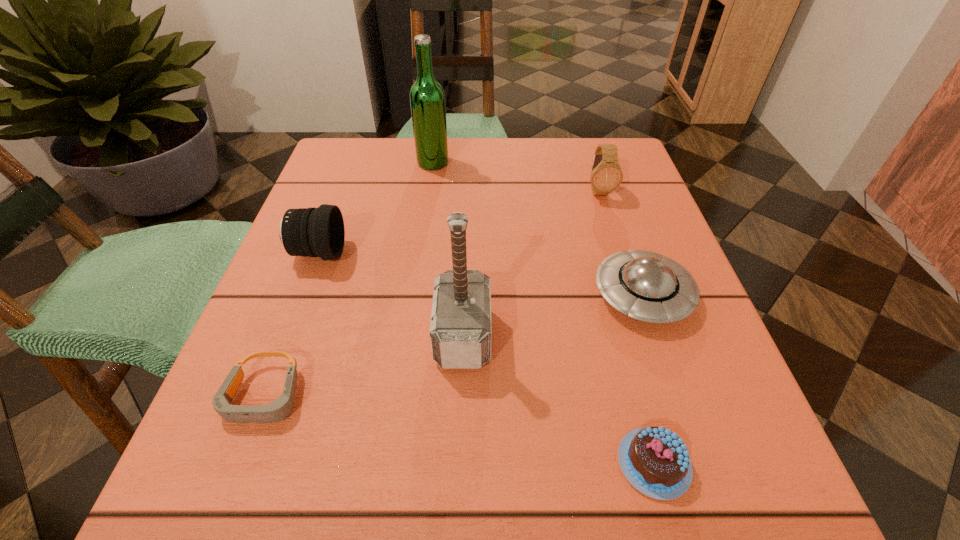
Locate an element on the screen. goggles located in the left edge section of the desktop is located at coordinates (280, 408).

Locate an element on the screen. watch that is at the right edge is located at coordinates (606, 175).

Image resolution: width=960 pixels, height=540 pixels. Find the location of `saucer that is positioned at the right edge`. saucer that is positioned at the right edge is located at coordinates (649, 287).

Find the location of a particular element. The height and width of the screenshot is (540, 960). chocolate cake at the right edge is located at coordinates (654, 460).

At what (x,y) coordinates should I click in order to perform the action: click on object at the far right corner. Please return your answer as a coordinate pair (x, y). The width and height of the screenshot is (960, 540). Looking at the image, I should click on (606, 175).

Image resolution: width=960 pixels, height=540 pixels. I want to click on object that is positioned at the near right corner, so click(654, 460).

Identify the location of vacant space at the far edge of the desktop. (456, 150).

At what (x,y) coordinates should I click in order to perform the action: click on vacant space at the near edge. Please return your answer as a coordinate pair (x, y). Looking at the image, I should click on (342, 465).

Where is `blank space at the left edge`? Image resolution: width=960 pixels, height=540 pixels. blank space at the left edge is located at coordinates (331, 197).

This screenshot has height=540, width=960. I want to click on vacant space at the right edge of the desktop, so click(x=722, y=436).